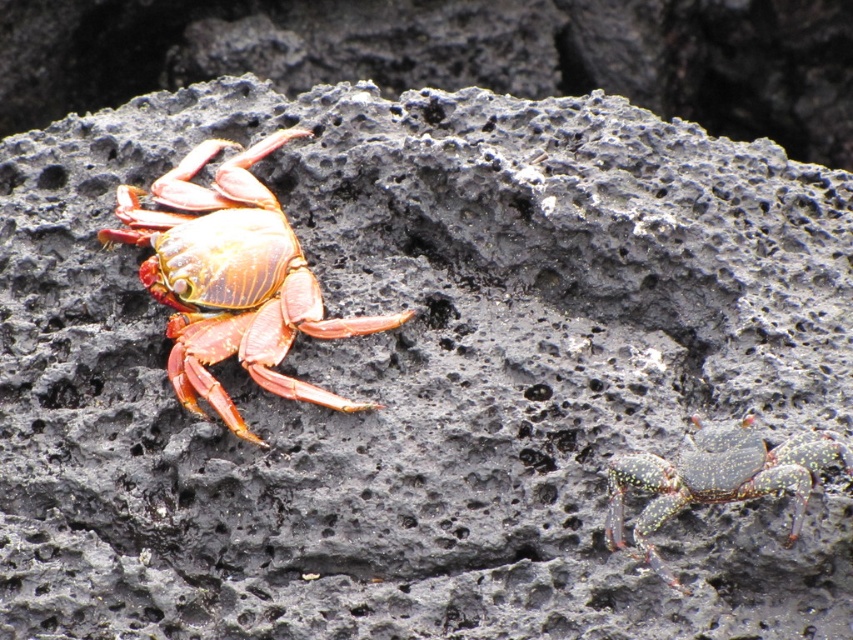
Question: Which point is closer to the camera?

Choices:
 (A) click(x=619, y=524)
 (B) click(x=231, y=349)

Answer: (A)

Question: Can you confirm if shiny orange crab at left is thinner than shiny metallic crab at lower right?

Choices:
 (A) no
 (B) yes

Answer: (A)

Question: Which point is farther from the camera taking this photo?

Choices:
 (A) (201, 216)
 (B) (692, 458)

Answer: (A)

Question: Which object is closer to the camera taking this photo?

Choices:
 (A) shiny metallic crab at lower right
 (B) shiny orange crab at left

Answer: (A)

Question: Where is shiny orange crab at left located in relation to shiny metallic crab at lower right in the image?

Choices:
 (A) right
 (B) left

Answer: (B)

Question: Can you confirm if shiny orange crab at left is positioned below shiny metallic crab at lower right?

Choices:
 (A) no
 (B) yes

Answer: (A)